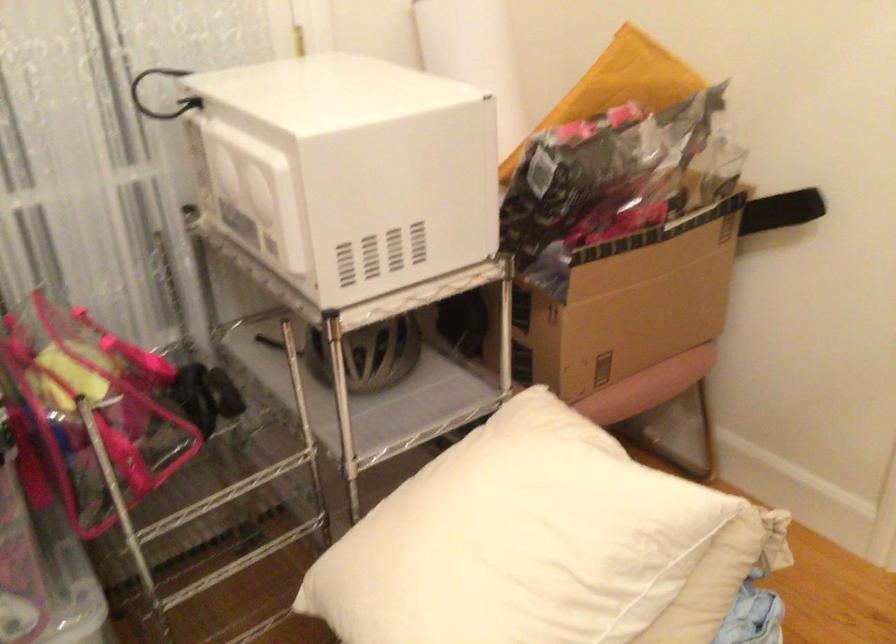
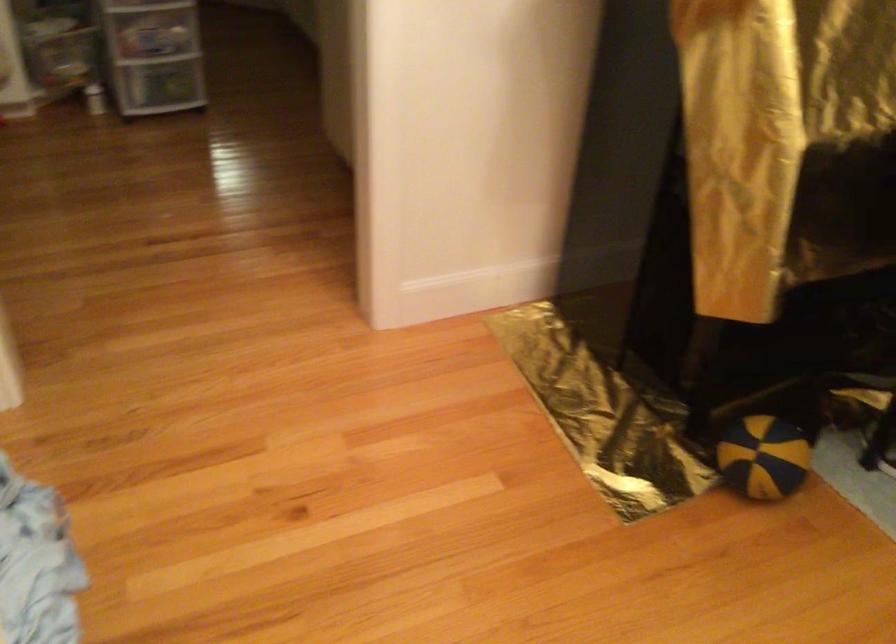
Based on the continuous images, in which direction is the camera rotating?

The camera rotated toward right-down.